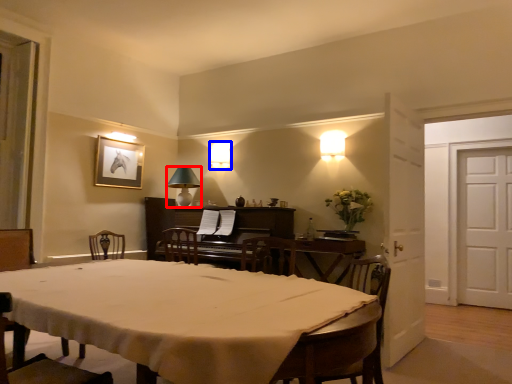
Question: Which of the following is the closest to the observer, lamp (highlighted by a red box) or lamp (highlighted by a blue box)?

Choices:
 (A) lamp
 (B) lamp

Answer: (A)